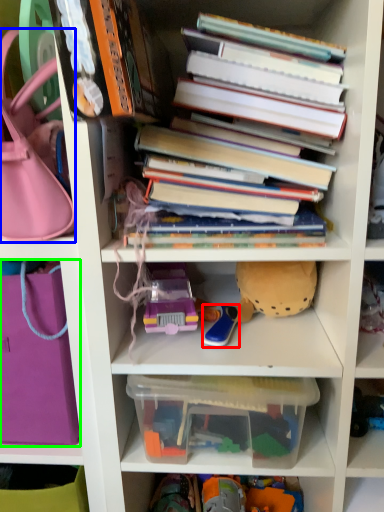
Question: Based on their relative distances, which object is nearer to toy (highlighted by a red box)? Choose from handbag (highlighted by a blue box) and handbag (highlighted by a green box).

Choices:
 (A) handbag
 (B) handbag

Answer: (B)